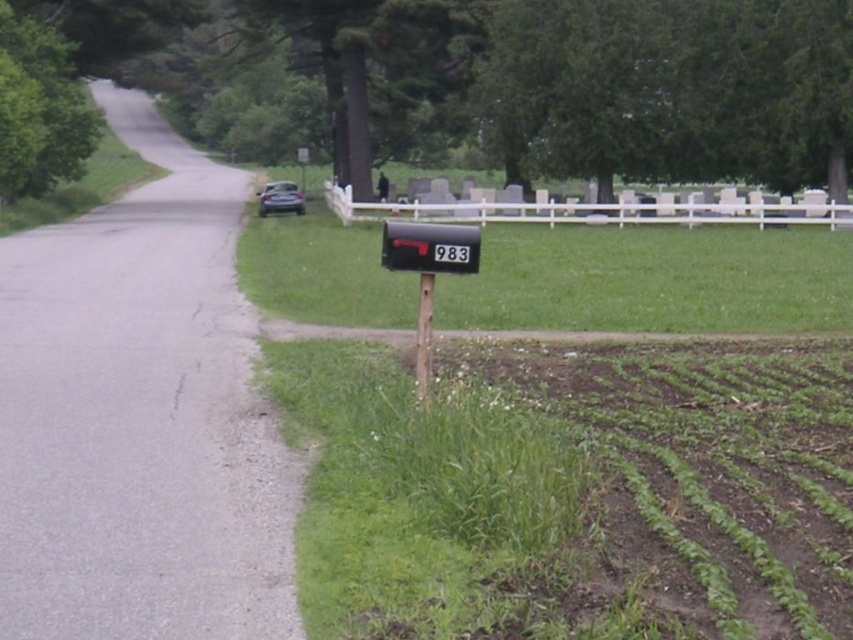
Does green grass at lower right appear on the left side of metallic black mailbox at center?

Incorrect, green grass at lower right is not on the left side of metallic black mailbox at center.

You are a GUI agent. You are given a task and a screenshot of the screen. Output one action in this format:
    pyautogui.click(x=<x>, y=<y>)
    Task: Click on the green grass at lower right
    This screenshot has width=853, height=640.
    Given the screenshot: What is the action you would take?
    pyautogui.click(x=573, y=492)

Which is in front, point (512, 404) or point (474, 237)?

Point (474, 237)

Identify the location of green grass at lower right. (573, 492).

Does metallic black mailbox at center have a lesser height compared to metallic mailbox at center?

Yes, metallic black mailbox at center is shorter than metallic mailbox at center.

Between metallic black mailbox at center and metallic mailbox at center, which one appears on the left side from the viewer's perspective?

metallic mailbox at center

Who is more distant from viewer, (405, 248) or (427, 337)?

The point (427, 337) is more distant.

Identify the location of metallic black mailbox at center. This screenshot has width=853, height=640. (430, 248).

How far apart are green grass at lower right and metallic mailbox at center?

green grass at lower right is 2.60 meters away from metallic mailbox at center.

Describe the element at coordinates (573, 492) in the screenshot. I see `green grass at lower right` at that location.

Does point (474, 506) come behind point (421, 368)?

That is False.

Image resolution: width=853 pixels, height=640 pixels. I want to click on green grass at lower right, so click(x=573, y=492).